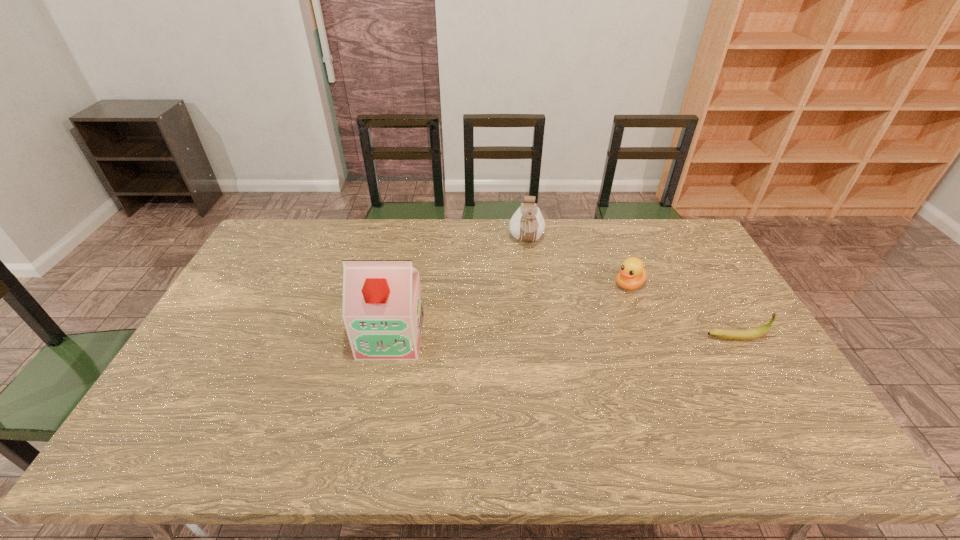
Image resolution: width=960 pixels, height=540 pixels. Find the location of `vacant region between the second farthest object and the tallest object`. vacant region between the second farthest object and the tallest object is located at coordinates (510, 310).

Where is `the second closest object to the second object from right to left`? the second closest object to the second object from right to left is located at coordinates (527, 224).

Locate which object is the third closest to the tallest object. Please provide its 2D coordinates. Your answer should be formatted as a tuple, i.e. [(x, y)], where the tuple contains the x and y coordinates of a point satisfying the conditions above.

[(739, 335)]

Find the location of a particular element. This screenshot has width=960, height=540. vacant area that satisfies the following two spatial constraints: 1. on the front side of the pouch; 2. at the stem of the rightmost object is located at coordinates (540, 338).

Identify the location of free space that satisfies the following two spatial constraints: 1. with the cap open on the rightmost object; 2. at the stem of the leftmost object. (391, 338).

Locate an element on the screen. The image size is (960, 540). vacant space that satisfies the following two spatial constraints: 1. with the cap open on the tallest object; 2. at the stem of the rightmost object is located at coordinates (391, 338).

Find the location of a particular element. free space that satisfies the following two spatial constraints: 1. on the front side of the third nearest object; 2. at the stem of the banana is located at coordinates (650, 338).

Where is `free spot that satisfies the following two spatial constraints: 1. with the cap open on the leftmost object; 2. at the stem of the banana`? free spot that satisfies the following two spatial constraints: 1. with the cap open on the leftmost object; 2. at the stem of the banana is located at coordinates point(391,338).

This screenshot has width=960, height=540. I want to click on vacant area that satisfies the following two spatial constraints: 1. on the front side of the rightmost object; 2. at the stem of the third nearest object, so 650,338.

Locate an element on the screen. This screenshot has height=540, width=960. vacant area that satisfies the following two spatial constraints: 1. with the cap open on the leftmost object; 2. at the stem of the banana is located at coordinates (391, 338).